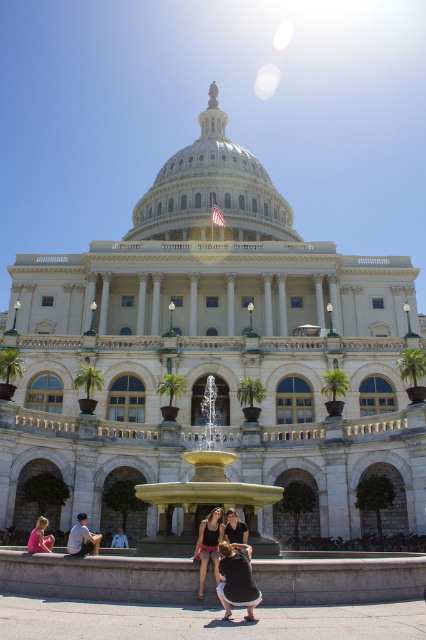
Question: Which point is closer to the camera?

Choices:
 (A) black fabric dress at center
 (B) white marble palace at center

Answer: (A)

Question: Is gold polished water at center to the right of black fabric dress at center from the viewer's perspective?

Choices:
 (A) no
 (B) yes

Answer: (A)

Question: Can you confirm if white marble palace at center is thinner than light brown leather jacket at lower left?

Choices:
 (A) no
 (B) yes

Answer: (A)

Question: Which point is closer to the camera?

Choices:
 (A) matte black dress at lower left
 (B) matte black tank top at center
 (C) light brown leather jacket at lower left

Answer: (C)

Question: Which object appears closest to the camera in this image?

Choices:
 (A) gold polished water at center
 (B) blue denim shirt at lower left

Answer: (A)

Question: Does white marble palace at center appear on the right side of blue denim shirt at lower left?

Choices:
 (A) no
 (B) yes

Answer: (B)